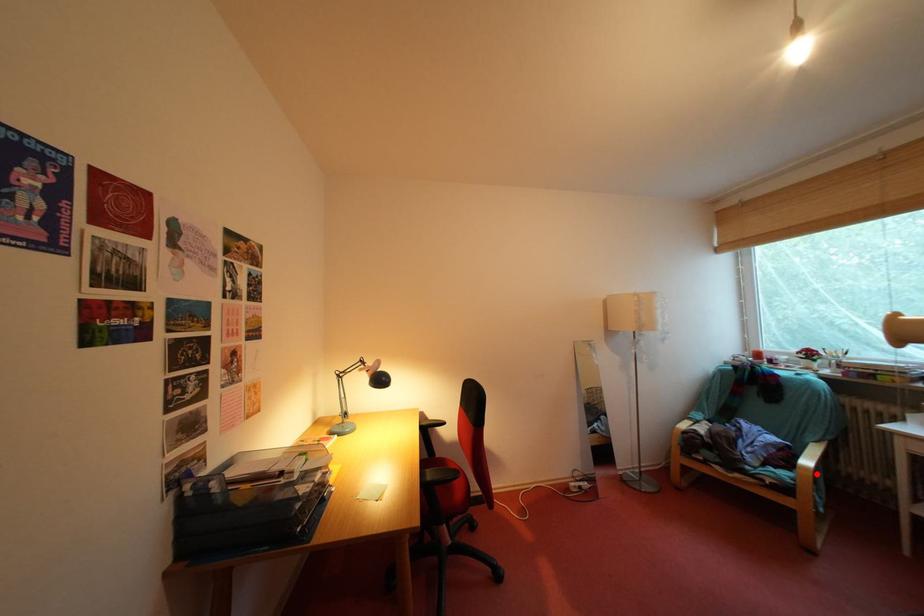
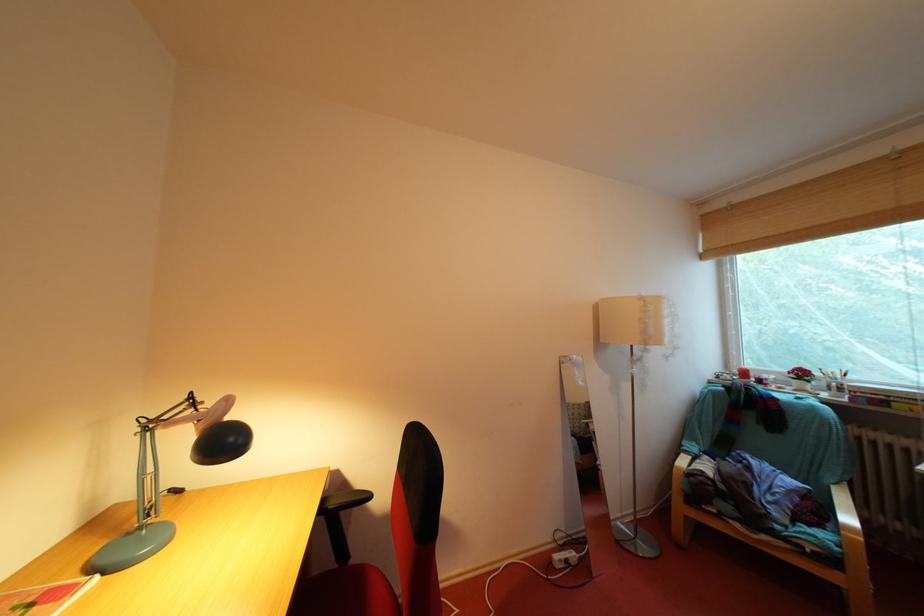
Question: A red point is marked in image1. In image2, is the corresponding 3D point closer to the camera or farther? Reply with the corresponding letter.

Choices:
 (A) The corresponding 3D point is closer.
 (B) The corresponding 3D point is farther.

Answer: (A)